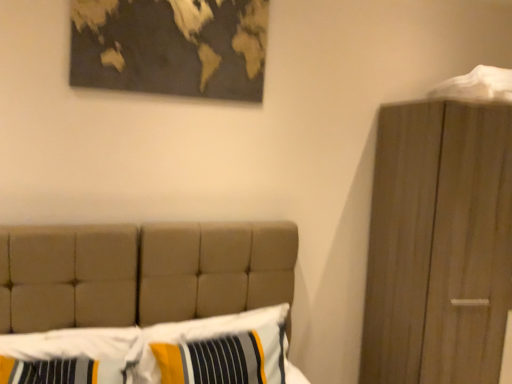
Question: Is striped fabric pillow at center, the first pillow viewed from the right, to the left of gold metallic map at upper center from the viewer's perspective?

Choices:
 (A) yes
 (B) no

Answer: (B)

Question: Is striped fabric pillow at center, the first pillow viewed from the right, looking in the opposite direction of gold metallic map at upper center?

Choices:
 (A) yes
 (B) no

Answer: (B)

Question: Is gold metallic map at upper center surrounded by striped fabric pillow at center, arranged as the second pillow when viewed from the left?

Choices:
 (A) no
 (B) yes

Answer: (A)

Question: Would you consider striped fabric pillow at center, the first pillow viewed from the right, to be distant from gold metallic map at upper center?

Choices:
 (A) no
 (B) yes

Answer: (B)

Question: Considering the relative sizes of striped fabric pillow at center, arranged as the second pillow when viewed from the left, and gold metallic map at upper center in the image provided, is striped fabric pillow at center, arranged as the second pillow when viewed from the left, thinner than gold metallic map at upper center?

Choices:
 (A) yes
 (B) no

Answer: (B)

Question: Does point (138, 264) appear closer or farther from the camera than point (479, 87)?

Choices:
 (A) closer
 (B) farther

Answer: (A)

Question: Considering the positions of textured beige bed at center and white fabric at upper right in the image, is textured beige bed at center wider or thinner than white fabric at upper right?

Choices:
 (A) wide
 (B) thin

Answer: (A)

Question: Based on their sizes in the image, would you say textured beige bed at center is bigger or smaller than white fabric at upper right?

Choices:
 (A) small
 (B) big

Answer: (B)

Question: From the image's perspective, is textured beige bed at center positioned above or below white fabric at upper right?

Choices:
 (A) below
 (B) above

Answer: (A)

Question: In the image, is striped fabric pillow at lower left, the second pillow viewed from the right, on the left side or the right side of white fabric at upper right?

Choices:
 (A) right
 (B) left

Answer: (B)

Question: Is striped fabric pillow at lower left, which appears as the 1th pillow when viewed from the left, bigger or smaller than white fabric at upper right?

Choices:
 (A) small
 (B) big

Answer: (B)

Question: From the image's perspective, relative to white fabric at upper right, is striped fabric pillow at lower left, which appears as the 1th pillow when viewed from the left, above or below?

Choices:
 (A) below
 (B) above

Answer: (A)

Question: Considering the positions of striped fabric pillow at lower left, the second pillow viewed from the right, and white fabric at upper right in the image, is striped fabric pillow at lower left, the second pillow viewed from the right, taller or shorter than white fabric at upper right?

Choices:
 (A) tall
 (B) short

Answer: (A)

Question: Is textured beige bed at center bigger or smaller than striped fabric pillow at lower left, which appears as the 1th pillow when viewed from the left?

Choices:
 (A) big
 (B) small

Answer: (A)

Question: From a real-world perspective, is textured beige bed at center above or below striped fabric pillow at lower left, which appears as the 1th pillow when viewed from the left?

Choices:
 (A) above
 (B) below

Answer: (A)